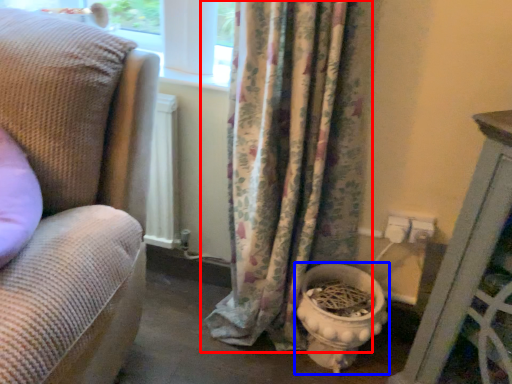
Question: Which of the following is the closest to the observer, curtain (highlighted by a red box) or toilet bowl (highlighted by a blue box)?

Choices:
 (A) curtain
 (B) toilet bowl

Answer: (A)